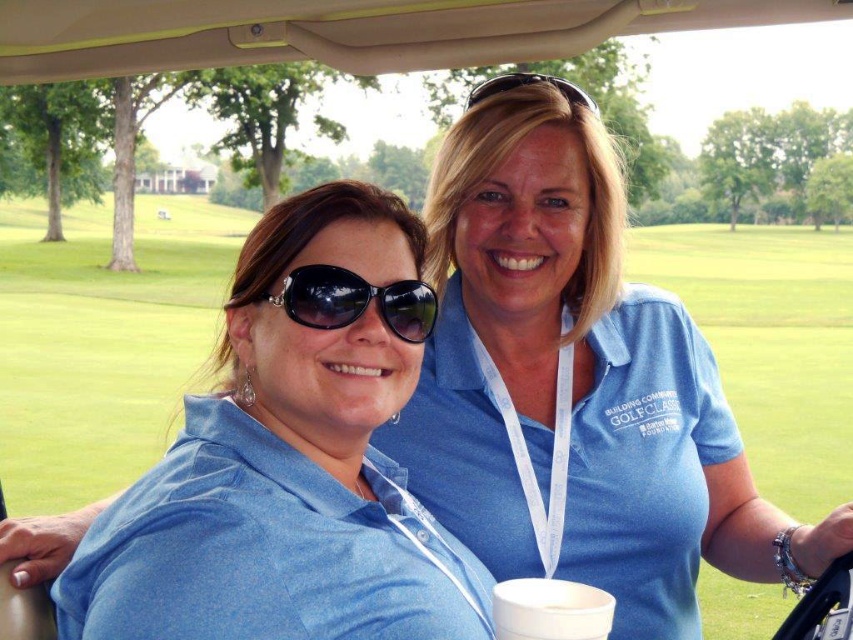
The height and width of the screenshot is (640, 853). What do you see at coordinates (355, 301) in the screenshot? I see `black reflective sunglasses at center` at bounding box center [355, 301].

Can you confirm if black reflective sunglasses at center is thinner than black plastic sunglasses at upper center?

Yes.

Does point (303, 305) come in front of point (567, 90)?

Yes, point (303, 305) is in front of point (567, 90).

Identify the location of black reflective sunglasses at center. (355, 301).

Who is shorter, blue cotton shirt at center or white paper cup at lower center?

Standing shorter between the two is white paper cup at lower center.

Does point (373, 611) come closer to viewer compared to point (538, 630)?

No, it is not.

Identify the location of blue cotton shirt at center. The height and width of the screenshot is (640, 853). (291, 458).

Between blue cotton shirt at center and black plastic sunglasses at upper center, which one is positioned higher?

black plastic sunglasses at upper center

Is point (401, 256) positioned in front of point (538, 81)?

That is True.

Identify the location of blue cotton shirt at center. Image resolution: width=853 pixels, height=640 pixels. (291, 458).